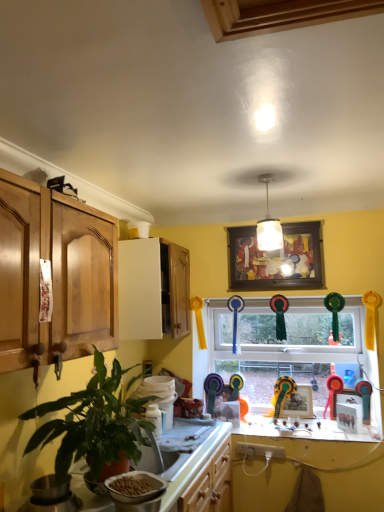
Describe the element at coordinates (276, 259) in the screenshot. The width and height of the screenshot is (384, 512). I see `wooden framed artwork at center, placed as the 1th picture frame when sorted from front to back` at that location.

I want to click on white glass pendant light at center, so click(x=268, y=225).

The image size is (384, 512). I want to click on white matte cabinet at center, so click(153, 289).

This screenshot has height=512, width=384. Describe the element at coordinates (94, 424) in the screenshot. I see `green leafy plant at left` at that location.

What do you see at coordinates (282, 393) in the screenshot? This screenshot has height=512, width=384. I see `metallic gold trophy at window` at bounding box center [282, 393].

Where is `white plastic bowl at lower center`? The width and height of the screenshot is (384, 512). white plastic bowl at lower center is located at coordinates (136, 490).

Does point (164, 319) come farther from viewer compared to point (350, 380)?

No.

Between white matte cabinet at center and glass window at center, which one has more height?

With more height is glass window at center.

In terms of size, does white matte cabinet at center appear bigger or smaller than glass window at center?

Clearly, white matte cabinet at center is smaller in size than glass window at center.

Is the position of metallic gold trophy at window less distant than that of green leafy plant at left?

No, the depth of metallic gold trophy at window is greater than that of green leafy plant at left.

Is metallic gold trophy at window turned away from green leafy plant at left?

No, metallic gold trophy at window's orientation is not away from green leafy plant at left.

Is metallic gold trophy at window far away from green leafy plant at left?

Yes.

Which of these two, metallic gold trophy at window or green leafy plant at left, is wider?

green leafy plant at left is wider.

From a real-world perspective, is green leafy plant at left below glass window at center?

Correct, in the physical world, green leafy plant at left is lower than glass window at center.

How much distance is there between green leafy plant at left and glass window at center?

green leafy plant at left is 5.01 feet from glass window at center.

Which object is positioned more to the right, green leafy plant at left or glass window at center?

glass window at center.

Between green leafy plant at left and glass window at center, which one has smaller width?

Thinner between the two is glass window at center.

Considering the relative sizes of glass window at center and wooden framed artwork at center, placed as the 1th picture frame when sorted from front to back, in the image provided, is glass window at center smaller than wooden framed artwork at center, placed as the 1th picture frame when sorted from front to back,?

Incorrect, glass window at center is not smaller in size than wooden framed artwork at center, placed as the 1th picture frame when sorted from front to back.

Is wooden framed artwork at center, placed as the 1th picture frame when sorted from front to back, completely or partially inside glass window at center?

No, wooden framed artwork at center, placed as the 1th picture frame when sorted from front to back, is not inside glass window at center.

From a real-world perspective, is glass window at center on top of wooden framed artwork at center, positioned as the second picture frame in bottom-to-top order?

Incorrect, from a real-world perspective, glass window at center is lower than wooden framed artwork at center, positioned as the second picture frame in bottom-to-top order.

Does glass window at center have a greater height compared to wooden framed artwork at center, marked as the second picture frame in a back-to-front arrangement?

Correct, glass window at center is much taller as wooden framed artwork at center, marked as the second picture frame in a back-to-front arrangement.

Does white glass pendant light at center have a smaller size compared to white plastic bowl at lower center?

No, white glass pendant light at center is not smaller than white plastic bowl at lower center.

How much distance is there between white glass pendant light at center and white plastic bowl at lower center?

white glass pendant light at center and white plastic bowl at lower center are 1.31 meters apart.

Considering the positions of point (273, 234) and point (120, 507), is point (273, 234) closer or farther from the camera than point (120, 507)?

Point (273, 234).

Based on their sizes in the image, would you say metallic gold trophy at window is bigger or smaller than white glass pendant light at center?

metallic gold trophy at window is bigger than white glass pendant light at center.

Between metallic gold trophy at window and white glass pendant light at center, which one has less height?

metallic gold trophy at window.

In the image, there is a metallic gold trophy at window. Where is `light fixture above it (from the image's perspective)`? This screenshot has width=384, height=512. light fixture above it (from the image's perspective) is located at coordinates (268, 225).

How different are the orientations of metallic gold trophy at window and white glass pendant light at center in degrees?

The angle between the facing direction of metallic gold trophy at window and the facing direction of white glass pendant light at center is 88.9 degrees.

Between white plastic bowl at lower center and glass window at center, which one has larger width?

white plastic bowl at lower center is wider.

From the image's perspective, does white plastic bowl at lower center appear higher than glass window at center?

Incorrect, from the image's perspective, white plastic bowl at lower center is lower than glass window at center.

How different are the orientations of white plastic bowl at lower center and glass window at center in degrees?

68.9 degrees separate the facing orientations of white plastic bowl at lower center and glass window at center.

Looking at this image, considering the sizes of objects white plastic bowl at lower center and glass window at center in the image provided, who is smaller, white plastic bowl at lower center or glass window at center?

white plastic bowl at lower center is smaller.

This screenshot has width=384, height=512. Find the location of `window that is behind the white matte cabinet at center`. window that is behind the white matte cabinet at center is located at coordinates (286, 346).

Where is `houseplant above the metallic gold trophy at window (from a real-world perspective)`? houseplant above the metallic gold trophy at window (from a real-world perspective) is located at coordinates (94, 424).

Considering their positions, is glass window at center positioned further to wooden framed artwork at center, acting as the first picture frame starting from the top, than white plastic bowl at lower center?

white plastic bowl at lower center is further to wooden framed artwork at center, acting as the first picture frame starting from the top.

Estimate the real-world distances between objects in this image. Which object is closer to white plastic bowl at lower center, metallic gold trophy at window or white glass pendant light at center?

The object closer to white plastic bowl at lower center is white glass pendant light at center.

From the image, which object appears to be nearer to matte wooden picture frame at center, acting as the second picture frame starting from the top, metallic gold trophy at window or white glass pendant light at center?

metallic gold trophy at window is closer to matte wooden picture frame at center, acting as the second picture frame starting from the top.

When comparing their distances from wooden framed artwork at center, marked as the second picture frame in a back-to-front arrangement, does yellow matte counter top at lower center or white glass pendant light at center seem closer?

white glass pendant light at center is closer to wooden framed artwork at center, marked as the second picture frame in a back-to-front arrangement.

When comparing their distances from matte wooden picture frame at center, the 1th picture frame ordered from the bottom, does metallic gold trophy at window or glass window at center seem further?

The object further to matte wooden picture frame at center, the 1th picture frame ordered from the bottom, is glass window at center.

Considering their positions, is white matte cabinet at center positioned closer to metallic gold trophy at window than yellow matte counter top at lower center?

Based on the image, yellow matte counter top at lower center appears to be nearer to metallic gold trophy at window.

When comparing their distances from matte wooden picture frame at center, which appears as the 2th picture frame when viewed from the front, does white plastic bowl at lower center or white matte cabinet at center seem further?

Based on the image, white plastic bowl at lower center appears to be further to matte wooden picture frame at center, which appears as the 2th picture frame when viewed from the front.

Which object lies nearer to the anchor point white plastic bowl at lower center, wooden framed artwork at center, placed as the 1th picture frame when sorted from front to back, or white glass pendant light at center?

white glass pendant light at center.

The width and height of the screenshot is (384, 512). What are the coordinates of `appliance between green leafy plant at left and yellow matte counter top at lower center along the z-axis` in the screenshot? It's located at (136, 490).

You are a GUI agent. You are given a task and a screenshot of the screen. Output one action in this format:
    pyautogui.click(x=<x>, y=<y>)
    Task: Click on the window that lies between wooden framed artwork at center, acting as the first picture frame starting from the top, and yellow matte counter top at lower center from top to bottom
    This screenshot has height=512, width=384.
    Given the screenshot: What is the action you would take?
    pyautogui.click(x=286, y=346)

Identify the location of cabinetry between green leafy plant at left and yellow matte counter top at lower center in the front-back direction. (153, 289).

You are a GUI agent. You are given a task and a screenshot of the screen. Output one action in this format:
    pyautogui.click(x=<x>, y=<y>)
    Task: Click on the appliance between green leafy plant at left and wooden framed artwork at center, marked as the second picture frame in a back-to-front arrangement, along the z-axis
    Image resolution: width=384 pixels, height=512 pixels.
    Given the screenshot: What is the action you would take?
    pyautogui.click(x=136, y=490)